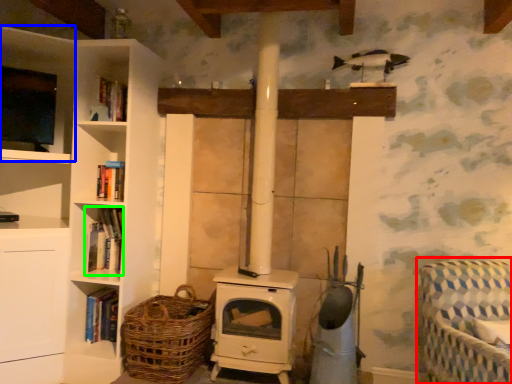
Question: Which object is positioned closest to rocking chair (highlighted by a red box)? Select from shelf (highlighted by a blue box) and book (highlighted by a green box).

Choices:
 (A) shelf
 (B) book

Answer: (B)